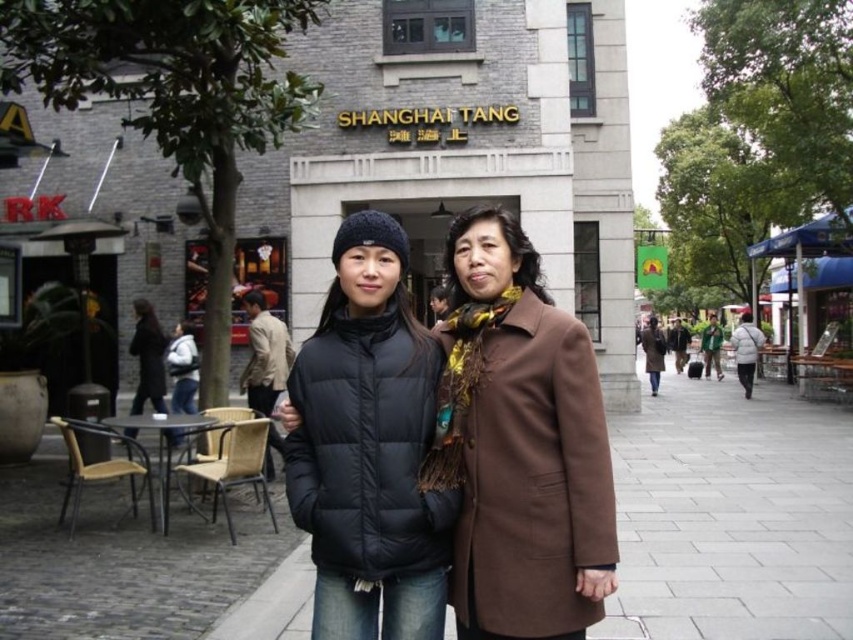
You are taking a photo of two people wearing jackets. The scene has a building with the sign Shanghai Tang above the entrance. You notice the green fabric jacket at center and the black matte jacket at center. Which jacket is positioned to the right side of the other?

The green fabric jacket at center is positioned to the right of the black matte jacket at center.

You are standing in front of the Shanghai Tang building and see two jackets at the center. Which jacket is nearer to you, the beige fabric jacket at center or the green fabric jacket at center?

The beige fabric jacket at center is closer to the viewer than the green fabric jacket at center, so the beige one is nearer.